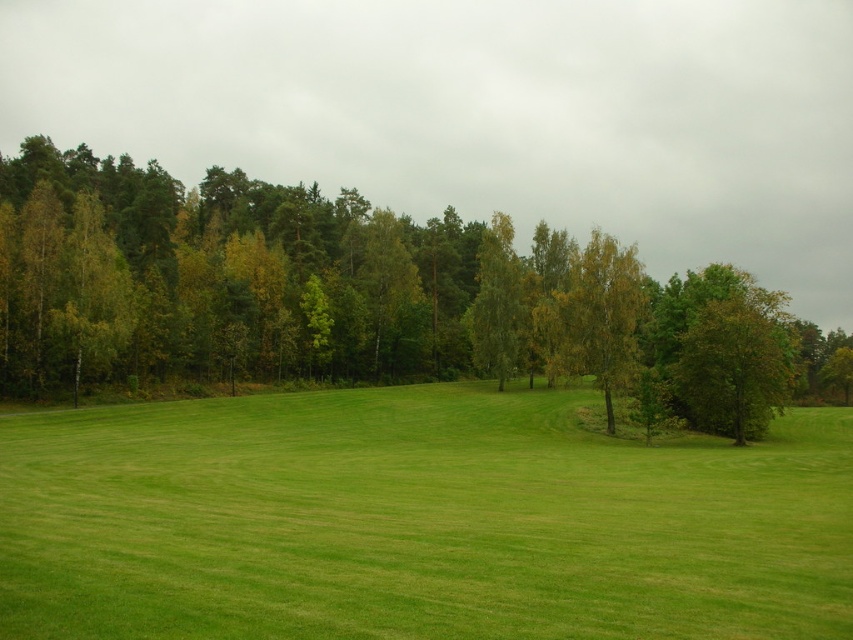
Question: Which point is farther from the camera taking this photo?

Choices:
 (A) (541, 621)
 (B) (444, 212)
 (C) (747, 314)

Answer: (B)

Question: Which point is farther from the camera taking this photo?

Choices:
 (A) (321, 298)
 (B) (753, 516)
 (C) (676, 371)

Answer: (A)

Question: Is green leafy tree at center closer to camera compared to green leafy tree at right?

Choices:
 (A) no
 (B) yes

Answer: (A)

Question: Is green grass at center bigger than green leafy tree at center?

Choices:
 (A) yes
 (B) no

Answer: (B)

Question: Does green grass at center have a lesser width compared to green leafy tree at center?

Choices:
 (A) no
 (B) yes

Answer: (B)

Question: Which point appears closest to the camera in this image?

Choices:
 (A) (466, 412)
 (B) (218, 332)
 (C) (718, 412)

Answer: (C)